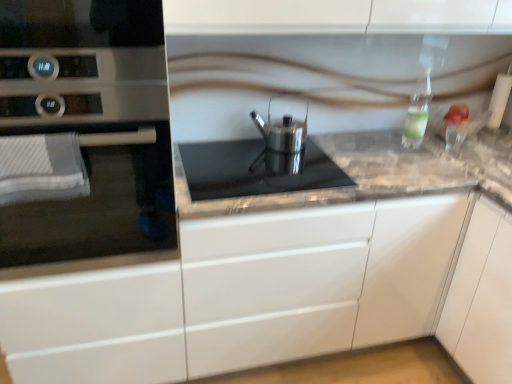
Question: Is satin silver cookware at center inside satin silver kettle at center?

Choices:
 (A) no
 (B) yes

Answer: (A)

Question: Does satin silver kettle at center appear on the right side of satin silver cookware at center?

Choices:
 (A) no
 (B) yes

Answer: (B)

Question: From the image's perspective, would you say satin silver kettle at center is shown under satin silver cookware at center?

Choices:
 (A) yes
 (B) no

Answer: (B)

Question: Is satin silver kettle at center closer to camera compared to satin silver cookware at center?

Choices:
 (A) no
 (B) yes

Answer: (A)

Question: Is satin silver kettle at center thinner than satin silver cookware at center?

Choices:
 (A) yes
 (B) no

Answer: (A)

Question: Looking at their shapes, would you say satin silver kettle at center is wider or thinner than marble gray counter at center?

Choices:
 (A) wide
 (B) thin

Answer: (B)

Question: From the image's perspective, is satin silver kettle at center positioned above or below marble gray counter at center?

Choices:
 (A) below
 (B) above

Answer: (B)

Question: Looking at the image, does satin silver kettle at center seem bigger or smaller compared to marble gray counter at center?

Choices:
 (A) big
 (B) small

Answer: (B)

Question: From a real-world perspective, is satin silver kettle at center physically located above or below marble gray counter at center?

Choices:
 (A) above
 (B) below

Answer: (A)

Question: Considering the positions of point (159, 61) and point (216, 233), is point (159, 61) closer or farther from the camera than point (216, 233)?

Choices:
 (A) closer
 (B) farther

Answer: (A)

Question: From their relative heights in the image, would you say satin silver oven at left is taller or shorter than marble gray counter at center?

Choices:
 (A) tall
 (B) short

Answer: (B)

Question: Is satin silver oven at left to the left or to the right of marble gray counter at center in the image?

Choices:
 (A) right
 (B) left

Answer: (B)

Question: From a real-world perspective, is satin silver oven at left above or below marble gray counter at center?

Choices:
 (A) above
 (B) below

Answer: (A)

Question: Looking at their shapes, would you say clear glass bottle at upper right is wider or thinner than satin silver cookware at center?

Choices:
 (A) wide
 (B) thin

Answer: (B)

Question: Is clear glass bottle at upper right inside the boundaries of satin silver cookware at center, or outside?

Choices:
 (A) inside
 (B) outside

Answer: (B)